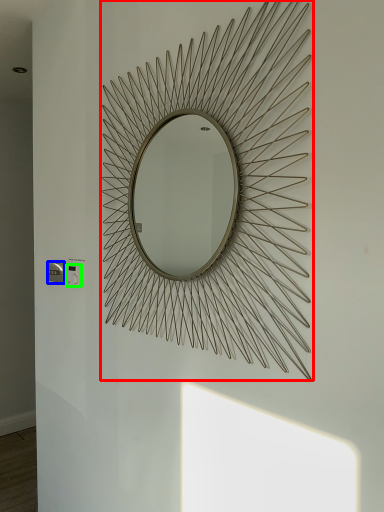
Question: Which object is positioned farthest from mirror (highlighted by a red box)? Select from electric outlet (highlighted by a blue box) and electric outlet (highlighted by a green box).

Choices:
 (A) electric outlet
 (B) electric outlet

Answer: (A)